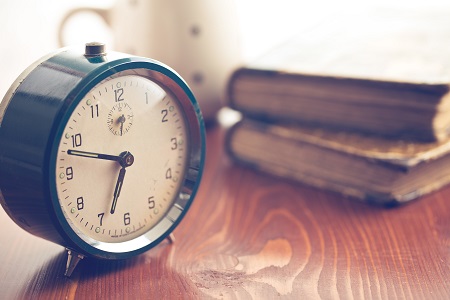
Find the location of a particular element. The height and width of the screenshot is (300, 450). wood surface is located at coordinates (258, 251).